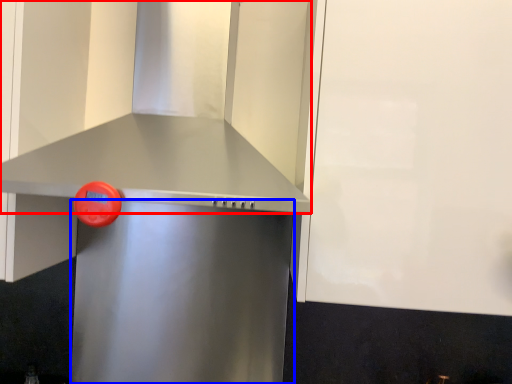
Question: Which object appears closest to the camera in this image, vent (highlighted by a red box) or appliance (highlighted by a blue box)?

Choices:
 (A) vent
 (B) appliance

Answer: (A)